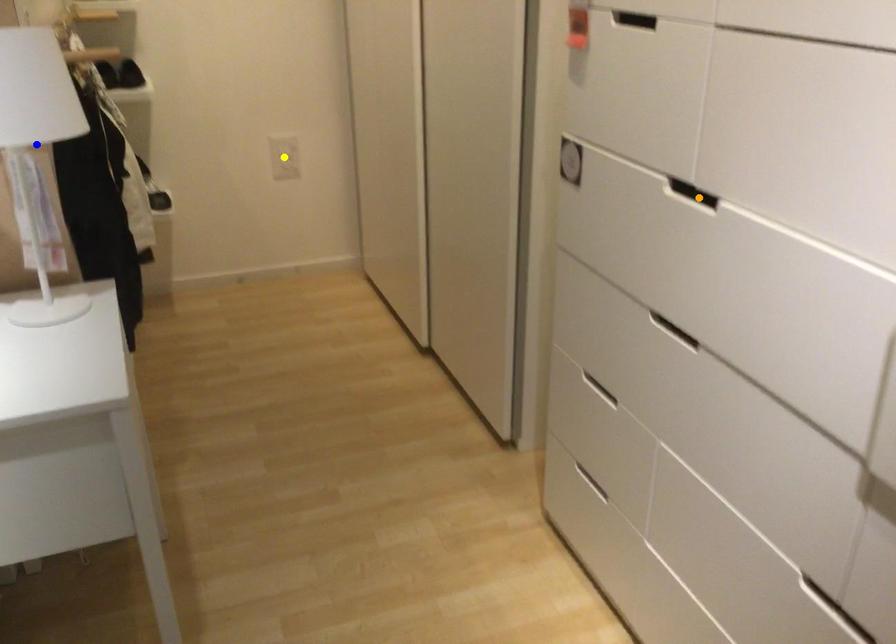
Looking at this image, order these from nearest to farthest:
A) orange point
B) yellow point
C) blue point

orange point
blue point
yellow point